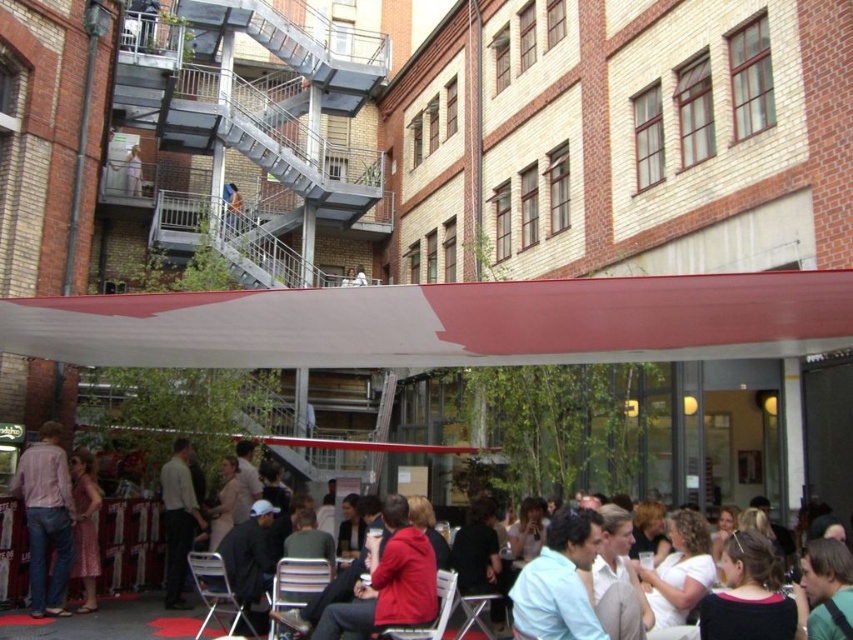
Measure the distance between red fabric chair at center and camera.

red fabric chair at center and camera are 29.49 meters apart.

Can you confirm if red fabric chair at center is bigger than plaid shirt at lower left?

Yes.

You are a GUI agent. You are given a task and a screenshot of the screen. Output one action in this format:
    pyautogui.click(x=<x>, y=<y>)
    Task: Click on the red fabric chair at center
    
    Given the screenshot: What is the action you would take?
    pyautogui.click(x=108, y=621)

Locate an element on the screen. The height and width of the screenshot is (640, 853). red fabric chair at center is located at coordinates (108, 621).

Does plaid shirt at lower left appear under light brown leather jacket at lower center?

No.

Between plaid shirt at lower left and light brown leather jacket at lower center, which one has less height?

light brown leather jacket at lower center

Locate an element on the screen. This screenshot has height=640, width=853. plaid shirt at lower left is located at coordinates (45, 518).

Where is `plaid shirt at lower left`? plaid shirt at lower left is located at coordinates (45, 518).

Is red fabric chair at center below light brown leather jacket at lower center?

Yes.

Who is higher up, red fabric chair at center or light brown leather jacket at lower center?

Positioned higher is light brown leather jacket at lower center.

The height and width of the screenshot is (640, 853). What are the coordinates of `red fabric chair at center` in the screenshot? It's located at (108, 621).

The image size is (853, 640). Find the location of `red fabric chair at center`. red fabric chair at center is located at coordinates (108, 621).